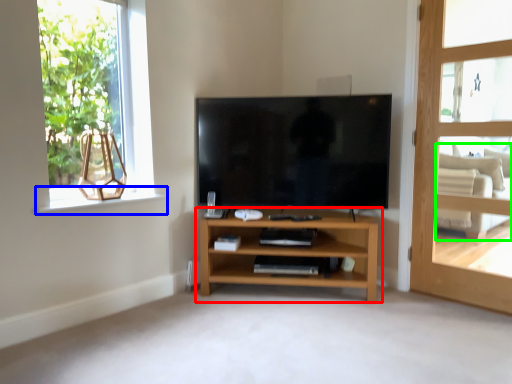
Question: Based on their relative distances, which object is farther from shelf (highlighted by a red box)? Choose from window sill (highlighted by a blue box) and armchair (highlighted by a green box).

Choices:
 (A) window sill
 (B) armchair

Answer: (B)